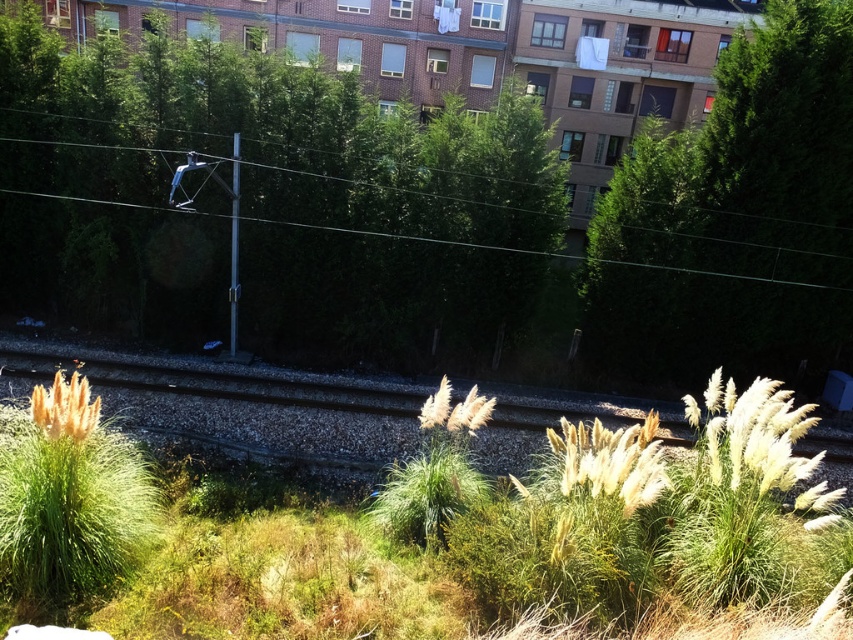
Question: Does green leafy tree at center appear under green leafy tree at upper center?

Choices:
 (A) yes
 (B) no

Answer: (B)

Question: Can you confirm if green leafy tree at center is bigger than green leafy tree at upper center?

Choices:
 (A) yes
 (B) no

Answer: (A)

Question: Is green leafy tree at center positioned in front of green leafy tree at upper center?

Choices:
 (A) no
 (B) yes

Answer: (A)

Question: Which point is farther to the camera?

Choices:
 (A) green leafy tree at center
 (B) green leafy tree at upper center

Answer: (A)

Question: Which object is farther from the camera taking this photo?

Choices:
 (A) green leafy tree at center
 (B) green leafy tree at upper center

Answer: (A)